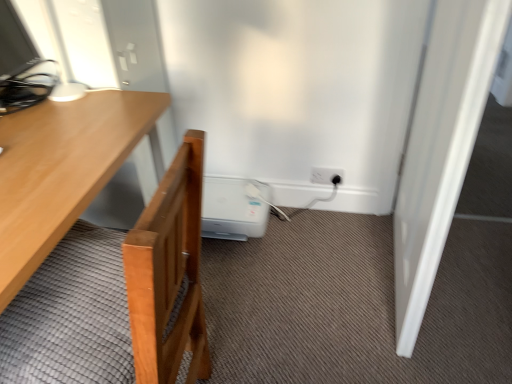
In order to face wooden desk at left, should I rotate leftwards or rightwards?

You should look left and rotate roughly 26.361 degrees.

Image resolution: width=512 pixels, height=384 pixels. What do you see at coordinates (326, 176) in the screenshot? I see `white plastic electric outlet at lower right` at bounding box center [326, 176].

In order to click on white smooth door at right in this screenshot , I will do `click(441, 147)`.

The width and height of the screenshot is (512, 384). What are the coordinates of `wooden desk at left` in the screenshot? It's located at (61, 170).

Does point (324, 181) come behind point (209, 188)?

No, (324, 181) is closer to viewer.

In the image, is white plastic electric outlet at lower right positioned in front of or behind white plastic water heater at lower center?

Clearly, white plastic electric outlet at lower right is behind white plastic water heater at lower center.

Which object is wider, white plastic electric outlet at lower right or white plastic water heater at lower center?

white plastic water heater at lower center is wider.

Which of these two, white plastic electric outlet at lower right or white plastic water heater at lower center, stands taller?

Standing taller between the two is white plastic water heater at lower center.

Is white plastic electric outlet at lower right not within wooden desk at left?

Yes, white plastic electric outlet at lower right is outside of wooden desk at left.

The height and width of the screenshot is (384, 512). I want to click on desk above the white plastic electric outlet at lower right (from a real-world perspective), so click(x=61, y=170).

Between white plastic electric outlet at lower right and wooden desk at left, which one has smaller width?

Thinner between the two is white plastic electric outlet at lower right.

Which is in front, point (312, 173) or point (56, 152)?

The point (56, 152) is closer.

The width and height of the screenshot is (512, 384). I want to click on door positioned vertically above the white plastic water heater at lower center (from a real-world perspective), so click(441, 147).

Considering the relative sizes of white plastic water heater at lower center and white smooth door at right in the image provided, is white plastic water heater at lower center taller than white smooth door at right?

No, white plastic water heater at lower center is not taller than white smooth door at right.

Is white plastic water heater at lower center oriented away from white smooth door at right?

No, white smooth door at right is not at the back of white plastic water heater at lower center.

Based on their sizes in the image, would you say white plastic water heater at lower center is bigger or smaller than white smooth door at right?

Clearly, white plastic water heater at lower center is smaller in size than white smooth door at right.

Could you tell me if white plastic water heater at lower center is facing white plastic electric outlet at lower right?

No, white plastic water heater at lower center does not turn towards white plastic electric outlet at lower right.

Considering the relative sizes of white plastic water heater at lower center and white plastic electric outlet at lower right in the image provided, is white plastic water heater at lower center thinner than white plastic electric outlet at lower right?

No.

From a real-world perspective, between white plastic water heater at lower center and white plastic electric outlet at lower right, who is vertically lower?

From a 3D spatial view, white plastic water heater at lower center is below.

Looking at this image, between white plastic water heater at lower center and white plastic electric outlet at lower right, which one has larger size?

Bigger between the two is white plastic water heater at lower center.

Is wooden desk at left taller than white plastic electric outlet at lower right?

Indeed, wooden desk at left has a greater height compared to white plastic electric outlet at lower right.

Considering the relative positions of wooden desk at left and white plastic electric outlet at lower right in the image provided, is wooden desk at left to the left of white plastic electric outlet at lower right from the viewer's perspective?

Yes, wooden desk at left is to the left of white plastic electric outlet at lower right.

Is wooden desk at left oriented towards white plastic electric outlet at lower right?

No, wooden desk at left is not oriented towards white plastic electric outlet at lower right.

Is wooden desk at left not close to white smooth door at right?

No, wooden desk at left is not far from white smooth door at right.

Considering their positions, is wooden desk at left located in front of or behind white smooth door at right?

Clearly, wooden desk at left is in front of white smooth door at right.

From the image's perspective, would you say wooden desk at left is shown under white smooth door at right?

Yes, from the image's perspective, wooden desk at left is beneath white smooth door at right.

Is wooden desk at left bigger or smaller than white smooth door at right?

Clearly, wooden desk at left is larger in size than white smooth door at right.

Does point (428, 236) appear closer or farther from the camera than point (50, 214)?

Point (428, 236) is positioned farther from the camera compared to point (50, 214).

From the image's perspective, does white smooth door at right appear higher than wooden desk at left?

Yes, from the image's perspective, white smooth door at right is on top of wooden desk at left.

From a real-world perspective, is white smooth door at right above or below wooden desk at left?

From a real-world perspective, white smooth door at right is physically above wooden desk at left.

The width and height of the screenshot is (512, 384). Find the location of `desk below the white smooth door at right (from the image's perspective)`. desk below the white smooth door at right (from the image's perspective) is located at coordinates (61, 170).

Identify the location of electric outlet above the white plastic water heater at lower center (from the image's perspective). (326, 176).

Locate an element on the screen. The image size is (512, 384). electric outlet on the right of wooden desk at left is located at coordinates (326, 176).

Based on their spatial positions, is wooden desk at left or white plastic electric outlet at lower right further from white smooth door at right?

Based on the image, wooden desk at left appears to be further to white smooth door at right.

Based on their spatial positions, is white plastic water heater at lower center or wooden desk at left further from white plastic electric outlet at lower right?

The object further to white plastic electric outlet at lower right is wooden desk at left.

Consider the image. Based on their spatial positions, is white plastic electric outlet at lower right or wooden desk at left closer to white plastic water heater at lower center?

Among the two, white plastic electric outlet at lower right is located nearer to white plastic water heater at lower center.

From the image, which object appears to be nearer to white plastic water heater at lower center, white smooth door at right or wooden desk at left?

wooden desk at left is positioned closer to the anchor white plastic water heater at lower center.

Which object lies further to the anchor point wooden desk at left, white smooth door at right or white plastic electric outlet at lower right?

The object further to wooden desk at left is white plastic electric outlet at lower right.

When comparing their distances from white plastic electric outlet at lower right, does white smooth door at right or white plastic water heater at lower center seem further?

The object further to white plastic electric outlet at lower right is white smooth door at right.

When comparing their distances from white plastic water heater at lower center, does white plastic electric outlet at lower right or white smooth door at right seem closer?

Among the two, white plastic electric outlet at lower right is located nearer to white plastic water heater at lower center.

When comparing their distances from wooden desk at left, does white plastic electric outlet at lower right or white smooth door at right seem further?

The object further to wooden desk at left is white plastic electric outlet at lower right.

The image size is (512, 384). What are the coordinates of `water heater located between wooden desk at left and white smooth door at right in the left-right direction` in the screenshot? It's located at (232, 209).

Where is `door between wooden desk at left and white plastic electric outlet at lower right along the z-axis`? The image size is (512, 384). door between wooden desk at left and white plastic electric outlet at lower right along the z-axis is located at coordinates (441, 147).

The image size is (512, 384). Identify the location of water heater positioned between white smooth door at right and white plastic electric outlet at lower right from near to far. (232, 209).

The width and height of the screenshot is (512, 384). I want to click on water heater positioned between wooden desk at left and white plastic electric outlet at lower right from near to far, so click(232, 209).